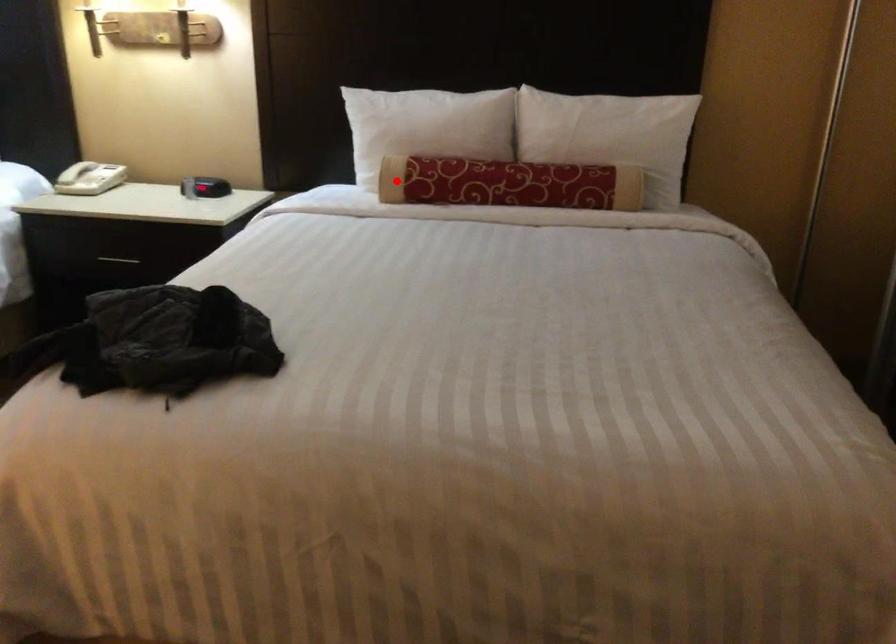
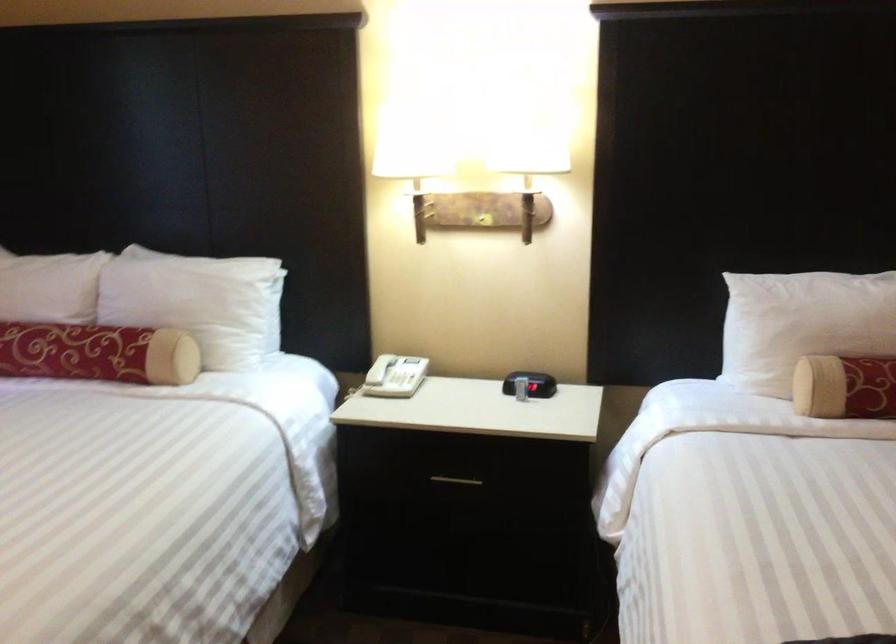
Find the pixel in the second image that matches the highlighted location in the first image.

(845, 386)